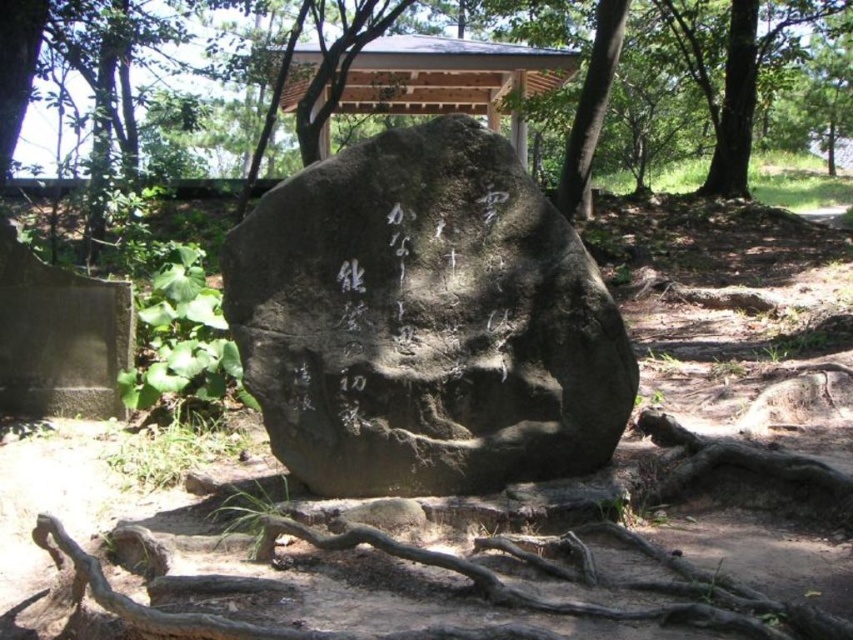
Question: Does dark gray stone at center have a lesser width compared to brown rough tree roots at lower center?

Choices:
 (A) yes
 (B) no

Answer: (A)

Question: Does dark gray stone at center have a lesser width compared to brown rough tree roots at lower center?

Choices:
 (A) yes
 (B) no

Answer: (A)

Question: Estimate the real-world distances between objects in this image. Which object is closer to the dark gray stone at center?

Choices:
 (A) brown rough tree roots at lower center
 (B) green leafy tree at center

Answer: (A)

Question: Which point is farther to the camera?

Choices:
 (A) dark gray stone at center
 (B) green leafy tree at center
 (C) brown rough tree roots at lower center

Answer: (B)

Question: Can you confirm if green leafy tree at center is positioned below brown rough tree roots at lower center?

Choices:
 (A) no
 (B) yes

Answer: (A)

Question: Which of the following is the closest to the observer?

Choices:
 (A) (456, 104)
 (B) (351, 321)

Answer: (B)